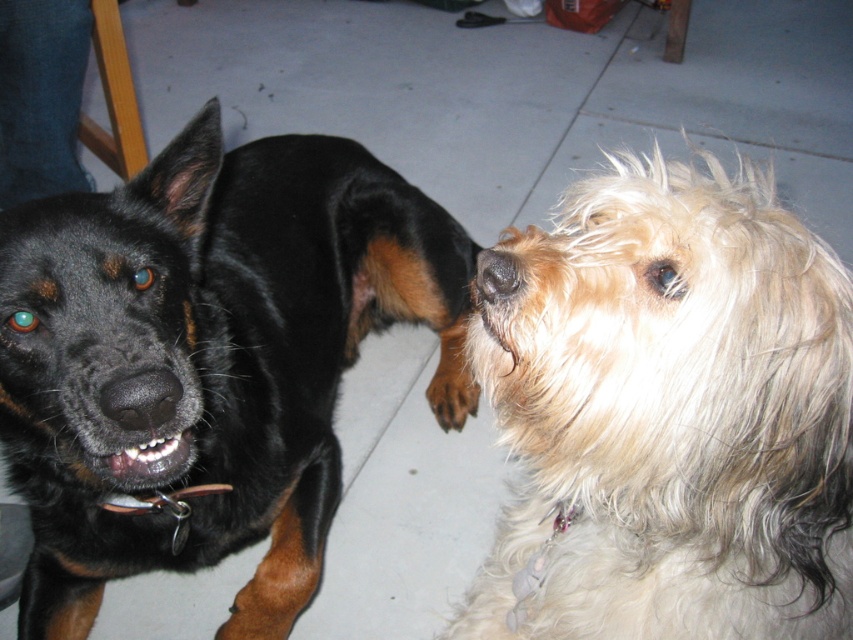
What object is located at the coordinates point (x=141, y=397)?

The point (x=141, y=397) corresponds to the black matte nose at center.

You are standing at the origin point in the room where the two dogs are located. You need to move towards the point at the location of point (119, 384) and point (506, 284). Which point will you reach first?

Point (506, 284) will be reached first because it is closer to the origin point compared to point (119, 384), which is further away.

You are a dog owner who wants to buy a new collar for your fluffy beige dog at right. The collar you have in mind is designed to fit dogs taller than the black matte nose at center. Will the collar fit your dog?

The fluffy beige dog at right has a greater height compared to the black matte nose at center, so the collar designed for dogs taller than the black matte nose at center will fit the fluffy beige dog at right.